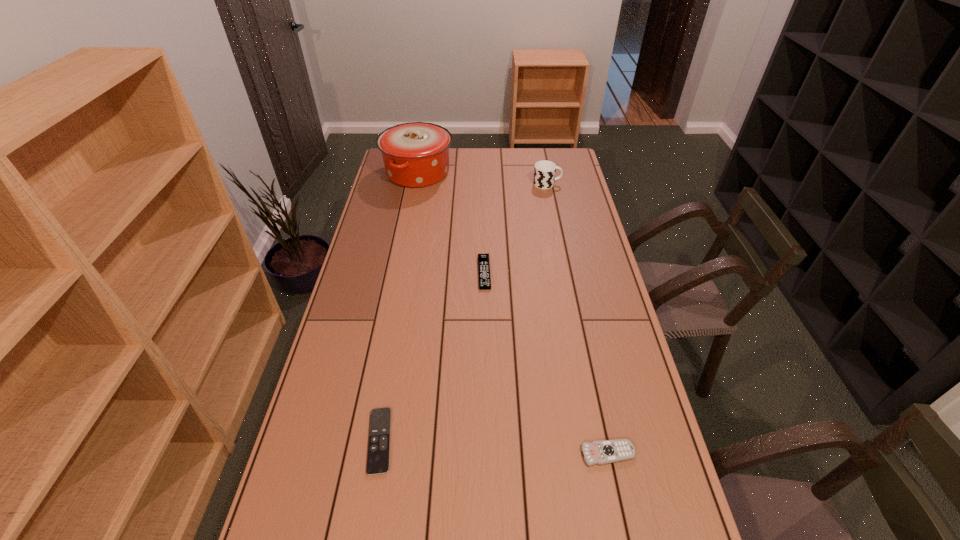
Identify the location of casserole. The width and height of the screenshot is (960, 540). (416, 154).

Identify the location of the second tallest object. The width and height of the screenshot is (960, 540). (544, 173).

Find the location of a particular element. the third object from right to left is located at coordinates (483, 259).

Locate an element on the screen. the third farthest object is located at coordinates (483, 259).

Locate an element on the screen. the rightmost remote control is located at coordinates (607, 451).

The image size is (960, 540). In order to click on the shortest remote control in this screenshot , I will do `click(378, 454)`.

Image resolution: width=960 pixels, height=540 pixels. What are the coordinates of `the shortest object` in the screenshot? It's located at (x=378, y=454).

I want to click on free region located on the right of the casserole, so click(512, 173).

Locate an element on the screen. Image resolution: width=960 pixels, height=540 pixels. free space located 0.360m on the left of the second remote control from right to left is located at coordinates (378, 273).

What are the coordinates of `vacant space situated 0.280m on the left of the rightmost remote control` in the screenshot? It's located at (470, 454).